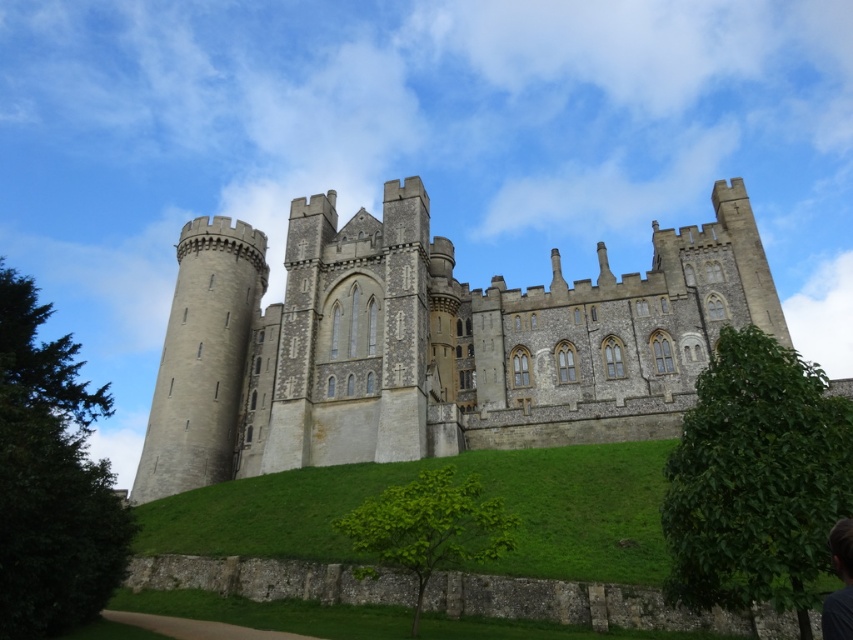
Which is more to the right, gray stone castle at center or dark brown hair at lower right?

dark brown hair at lower right is more to the right.

Can you confirm if gray stone castle at center is thinner than dark brown hair at lower right?

Incorrect, gray stone castle at center's width is not less than dark brown hair at lower right's.

Where is `gray stone castle at center`? The width and height of the screenshot is (853, 640). gray stone castle at center is located at coordinates (418, 337).